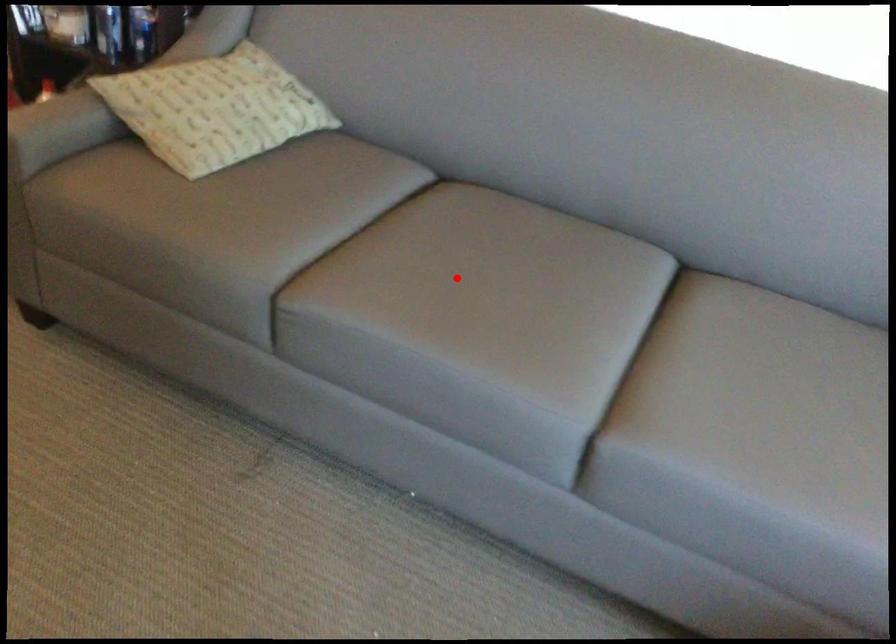
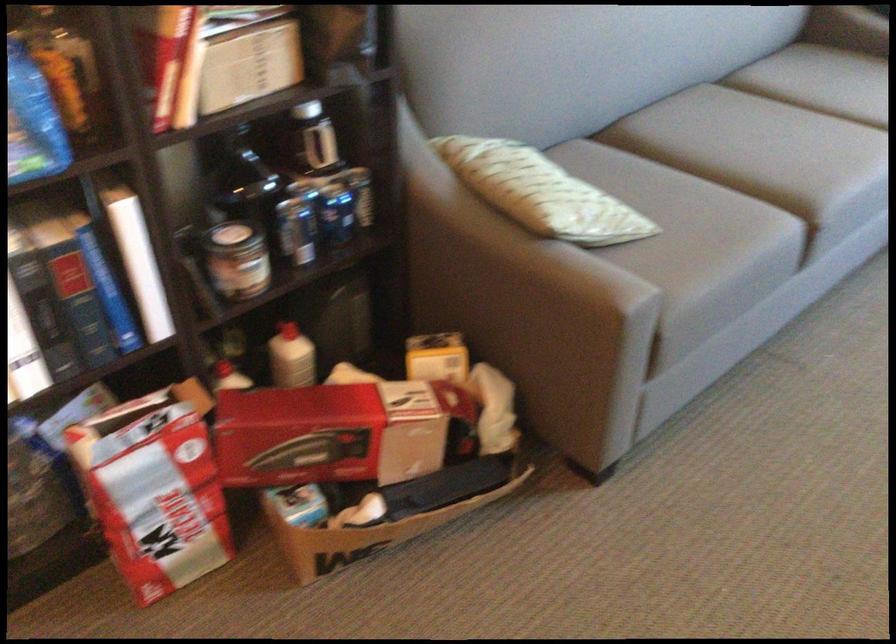
Where in the second image is the point corresponding to the highlighted location from the first image?

(760, 147)